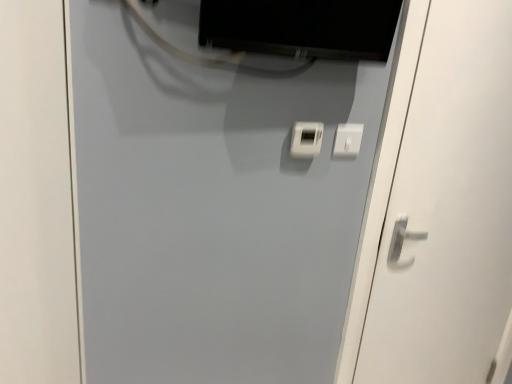
Question: From the image's perspective, does matte black monitor at upper center appear lower than white matte door at center, acting as the second door starting from the right?

Choices:
 (A) no
 (B) yes

Answer: (A)

Question: Considering the relative sizes of matte black monitor at upper center and white matte door at center, placed as the first door when sorted from left to right, in the image provided, is matte black monitor at upper center shorter than white matte door at center, placed as the first door when sorted from left to right,?

Choices:
 (A) yes
 (B) no

Answer: (A)

Question: Can white matte door at center, acting as the second door starting from the right, be found inside matte black monitor at upper center?

Choices:
 (A) yes
 (B) no

Answer: (B)

Question: Does matte black monitor at upper center come in front of white matte door at center, acting as the second door starting from the right?

Choices:
 (A) yes
 (B) no

Answer: (A)

Question: Is matte black monitor at upper center placed right next to white matte door at center, acting as the second door starting from the right?

Choices:
 (A) no
 (B) yes

Answer: (A)

Question: Can you confirm if matte black monitor at upper center is taller than white matte door at center, acting as the second door starting from the right?

Choices:
 (A) no
 (B) yes

Answer: (A)

Question: Is white matte door at center, acting as the second door starting from the right, wider than matte black monitor at upper center?

Choices:
 (A) no
 (B) yes

Answer: (A)

Question: Is white matte door at center, placed as the first door when sorted from left to right, far away from matte black monitor at upper center?

Choices:
 (A) no
 (B) yes

Answer: (A)

Question: From the image's perspective, is white matte door at center, placed as the first door when sorted from left to right, located beneath matte black monitor at upper center?

Choices:
 (A) no
 (B) yes

Answer: (B)

Question: Is white matte door at center, placed as the first door when sorted from left to right, turned away from matte black monitor at upper center?

Choices:
 (A) no
 (B) yes

Answer: (A)

Question: Would you say matte black monitor at upper center is part of white matte door at center, placed as the first door when sorted from left to right,'s contents?

Choices:
 (A) yes
 (B) no

Answer: (B)

Question: Considering the relative sizes of white matte door at center, placed as the first door when sorted from left to right, and matte black monitor at upper center in the image provided, is white matte door at center, placed as the first door when sorted from left to right, shorter than matte black monitor at upper center?

Choices:
 (A) no
 (B) yes

Answer: (A)

Question: Does matte black monitor at upper center appear on the right side of white plastic light switch at center?

Choices:
 (A) yes
 (B) no

Answer: (B)